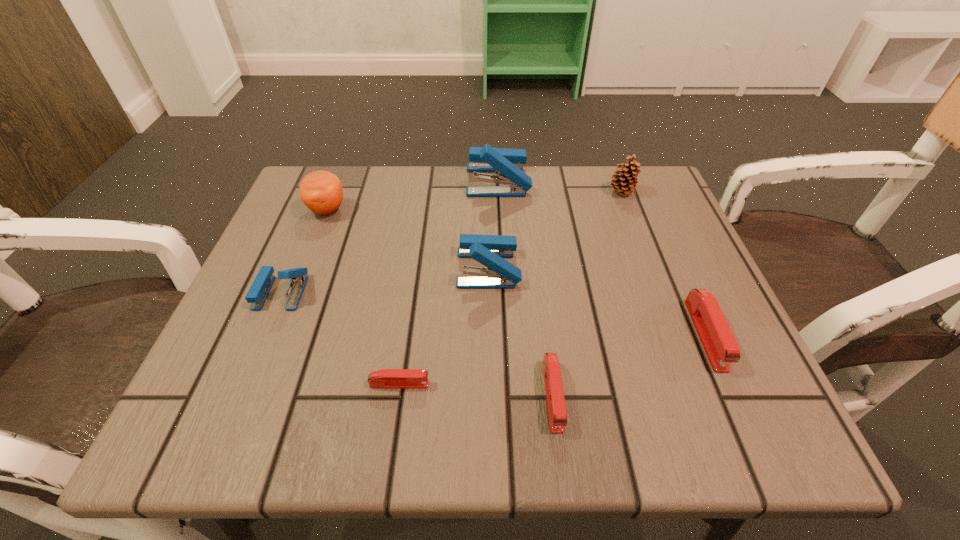
Where is `blue stapler that is the nearest to the third tallest stapler`? Image resolution: width=960 pixels, height=540 pixels. blue stapler that is the nearest to the third tallest stapler is located at coordinates (489, 250).

This screenshot has height=540, width=960. What are the coordinates of `red stapler that stands as the second closest to the shortest stapler` in the screenshot? It's located at (718, 341).

Where is `red stapler that stands as the closest to the pinecone`? The width and height of the screenshot is (960, 540). red stapler that stands as the closest to the pinecone is located at coordinates (718, 341).

Identify the location of vacant space that satisfies the following two spatial constraints: 1. on the front-facing side of the rightmost red stapler; 2. on the front-facing side of the shortest object. This screenshot has width=960, height=540. coord(727,384).